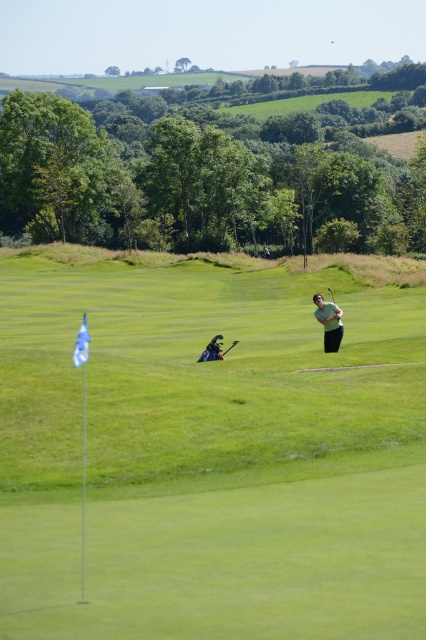
Which is more to the right, dark green fabric jacket at center or shiny black golf club at center?

From the viewer's perspective, shiny black golf club at center appears more on the right side.

Is dark green fabric jacket at center shorter than shiny black golf club at center?

Incorrect, dark green fabric jacket at center's height does not fall short of shiny black golf club at center's.

Does point (209, 353) come farther from viewer compared to point (233, 342)?

No.

Where is `dark green fabric jacket at center`? dark green fabric jacket at center is located at coordinates (212, 349).

The image size is (426, 640). I want to click on light brown leather golf club at center, so click(328, 323).

Is light brown leather golf club at center thinner than shiny black golf club at center?

Correct, light brown leather golf club at center's width is less than shiny black golf club at center's.

What do you see at coordinates (328, 323) in the screenshot? The height and width of the screenshot is (640, 426). I see `light brown leather golf club at center` at bounding box center [328, 323].

Locate an element on the screen. The image size is (426, 640). light brown leather golf club at center is located at coordinates (328, 323).

Between point (195, 515) and point (325, 323), which one is positioned in front?

Point (195, 515) is in front.

Is point (129, 580) in front of point (331, 352)?

That is True.

Where is `green grassy golf course at center`? green grassy golf course at center is located at coordinates (209, 452).